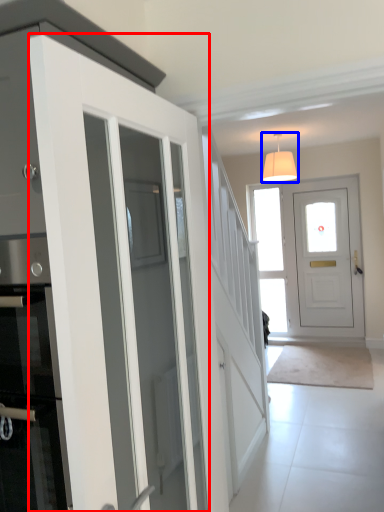
Question: Which point is closer to the camera, door (highlighted by a red box) or lamp (highlighted by a blue box)?

Choices:
 (A) door
 (B) lamp

Answer: (A)